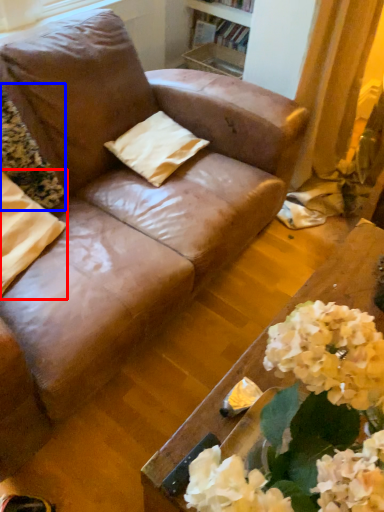
Question: Which object appears farthest to the camera in this image, pillow (highlighted by a red box) or flower (highlighted by a blue box)?

Choices:
 (A) pillow
 (B) flower

Answer: (B)